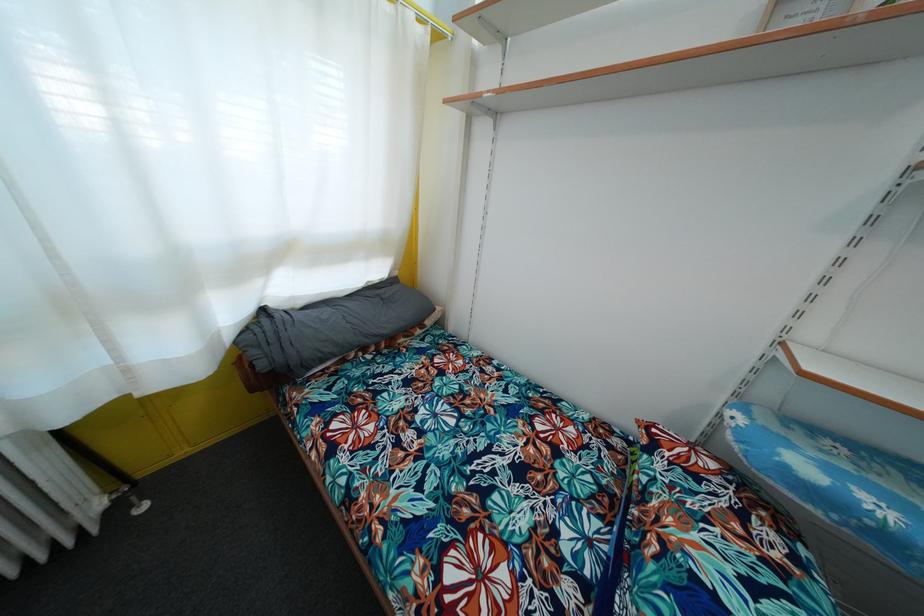
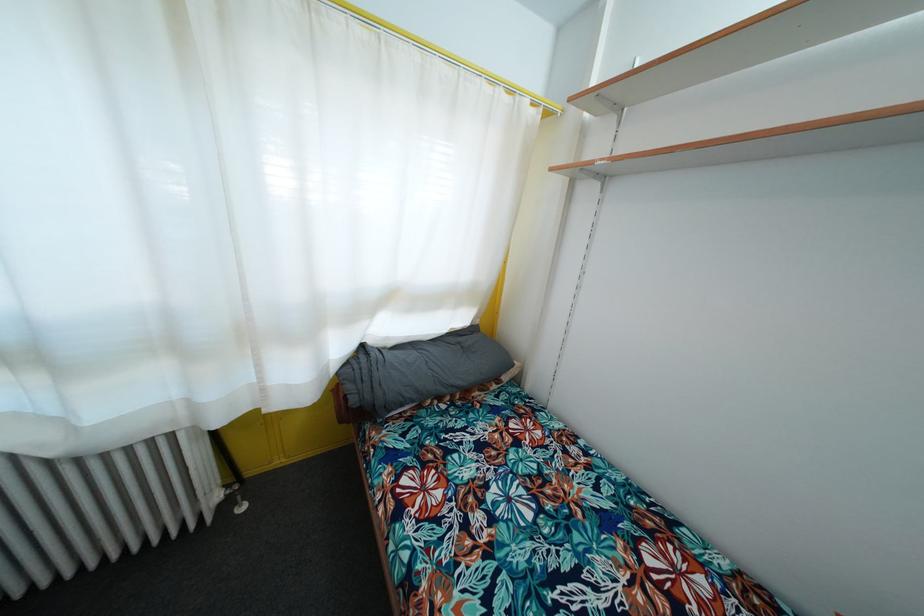
In the second image, find the point that corresponds to [265,371] in the first image.

(358, 407)